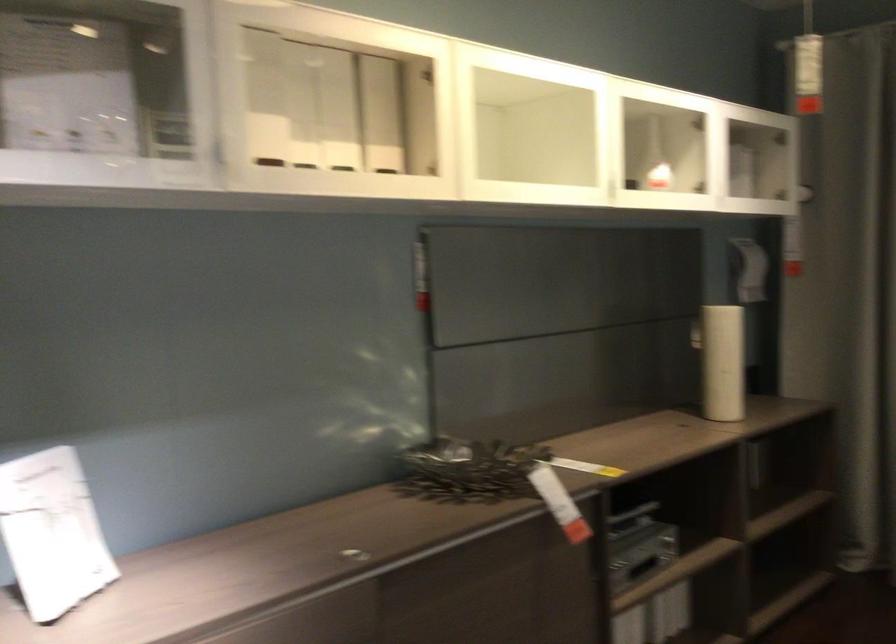
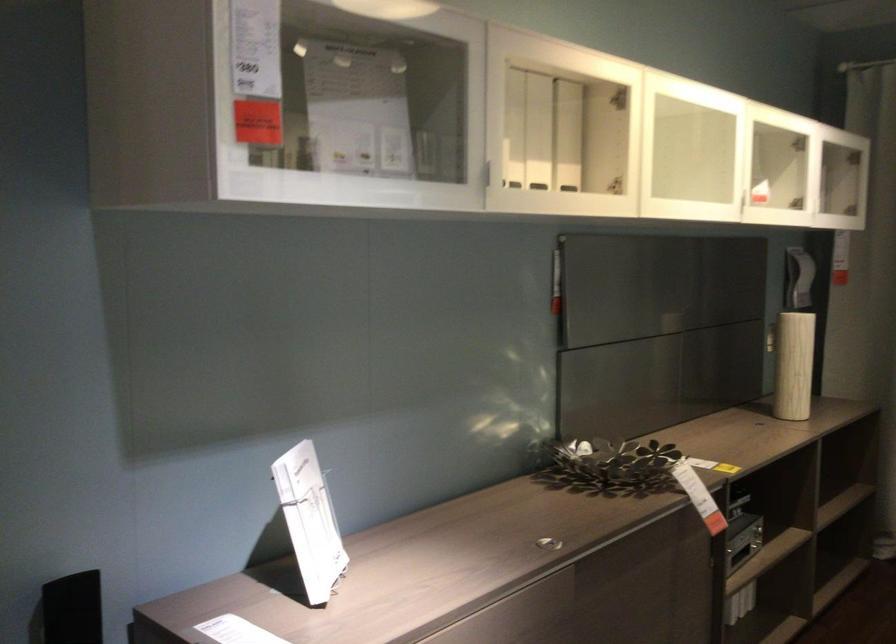
In the second image, find the point that corresponds to (x=357, y=552) in the first image.

(547, 543)